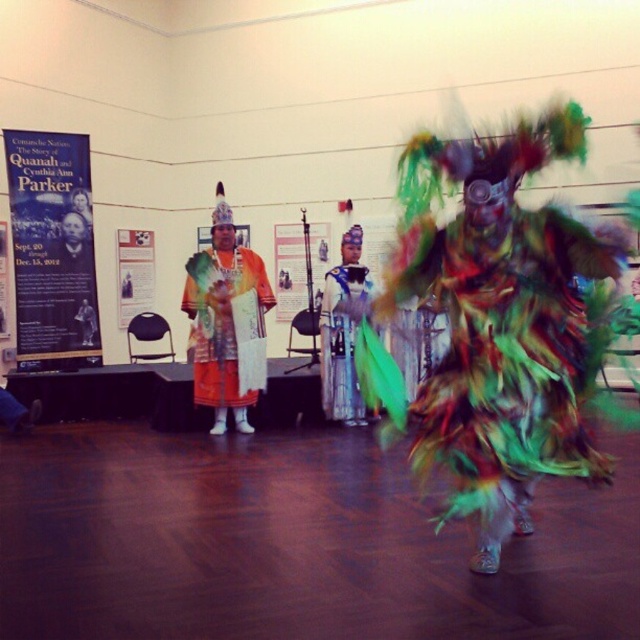
Does multicolored feathered costume at center appear over shiny metallic headdress at center?

Yes.

Does multicolored feathered costume at center appear on the left side of shiny metallic headdress at center?

In fact, multicolored feathered costume at center is to the right of shiny metallic headdress at center.

Is point (428, 442) less distant than point (337, 348)?

Yes, it is.

Image resolution: width=640 pixels, height=640 pixels. Find the location of `multicolored feathered costume at center`. multicolored feathered costume at center is located at coordinates (504, 321).

Is matte orange fabric at center positioned in front of white paper poster at center?

Yes, it is in front of white paper poster at center.

Between matte orange fabric at center and white paper poster at center, which one appears on the left side from the viewer's perspective?

white paper poster at center is more to the left.

Describe the element at coordinates (227, 323) in the screenshot. I see `matte orange fabric at center` at that location.

At what (x,y) coordinates should I click in order to perform the action: click on matte orange fabric at center. Please return your answer as a coordinate pair (x, y). Looking at the image, I should click on (227, 323).

Who is lower down, blue paper poster at left or shiny metallic headdress at center?

shiny metallic headdress at center is below.

You are a GUI agent. You are given a task and a screenshot of the screen. Output one action in this format:
    pyautogui.click(x=<x>, y=<y>)
    Task: Click on the blue paper poster at left
    
    Given the screenshot: What is the action you would take?
    pyautogui.click(x=52, y=244)

I want to click on blue paper poster at left, so click(x=52, y=244).